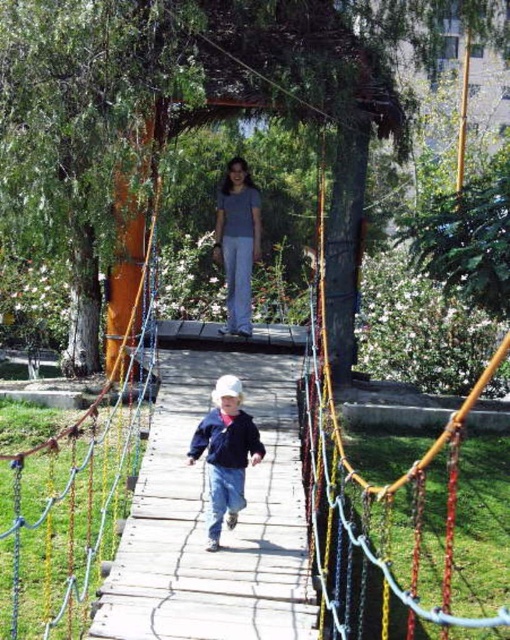
Question: Is wooden plank bridge at center behind denim jacket at center?

Choices:
 (A) yes
 (B) no

Answer: (B)

Question: Which of the following is the farthest from the observer?

Choices:
 (A) (283, 593)
 (B) (237, 216)

Answer: (B)

Question: Is wooden plank bridge at center below denim jacket at center?

Choices:
 (A) no
 (B) yes

Answer: (B)

Question: Which is nearer to the denim jacket at center?

Choices:
 (A) matte gray shirt at center
 (B) wooden plank bridge at center

Answer: (B)

Question: Can you confirm if wooden plank bridge at center is thinner than denim jacket at center?

Choices:
 (A) yes
 (B) no

Answer: (B)

Question: Based on their relative distances, which object is farther from the matte gray shirt at center?

Choices:
 (A) wooden plank bridge at center
 (B) denim jacket at center

Answer: (B)